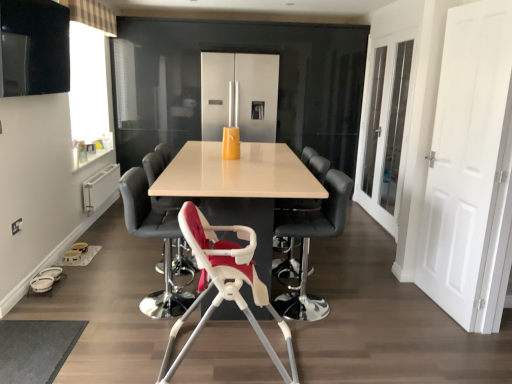
Find the location of a particular element. The height and width of the screenshot is (384, 512). free space in front of white matte door at right is located at coordinates (446, 337).